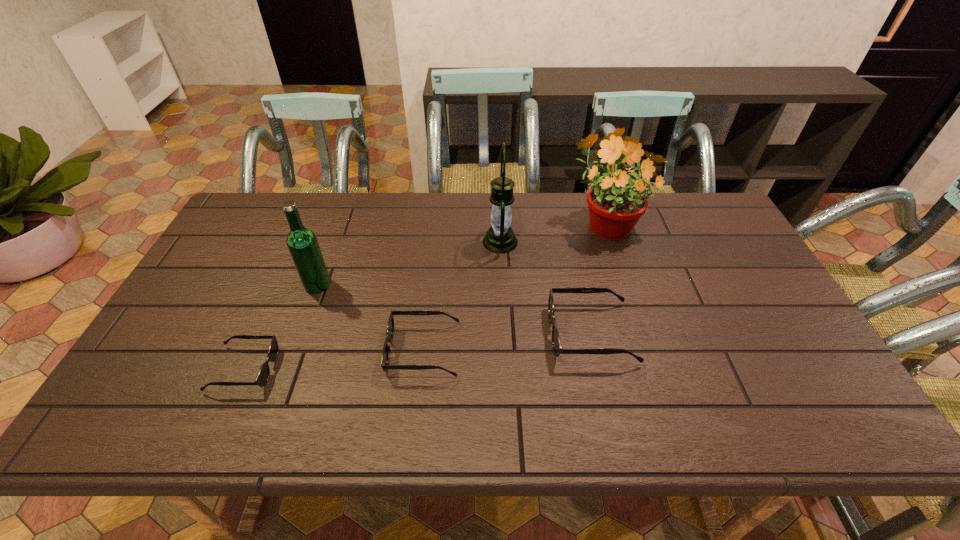
In the current image, all sunglassess are evenly spaced. To maintain this equal spacing, where should an additional sunglasses be placed on the right? Please point out a free spot. Please provide its 2D coordinates. Your answer should be formatted as a tuple, i.e. [(x, y)], where the tuple contains the x and y coordinates of a point satisfying the conditions above.

[(748, 318)]